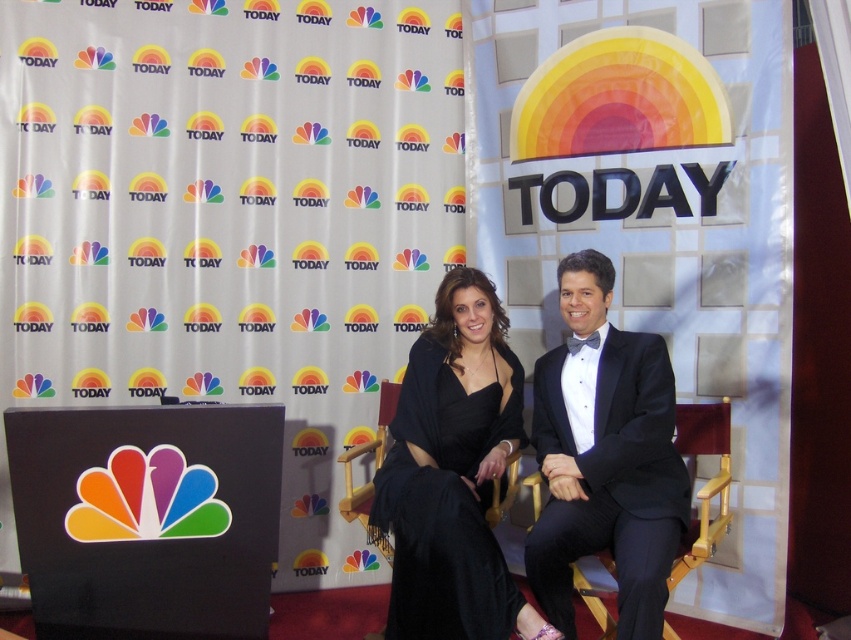
Question: Can you confirm if black pinstripe suit at center is smaller than black satin dress at center?

Choices:
 (A) no
 (B) yes

Answer: (B)

Question: Is black pinstripe suit at center wider than wooden chair at center?

Choices:
 (A) yes
 (B) no

Answer: (B)

Question: Among these points, which one is nearest to the camera?

Choices:
 (A) (574, 360)
 (B) (601, 556)

Answer: (B)

Question: Which point is closer to the camera taking this photo?

Choices:
 (A) (535, 552)
 (B) (444, 561)

Answer: (B)

Question: In this image, where is black pinstripe suit at center located relative to wooden chair at center?

Choices:
 (A) below
 (B) above

Answer: (B)

Question: Which point appears farthest from the camera in this image?

Choices:
 (A) (707, 448)
 (B) (612, 461)

Answer: (A)